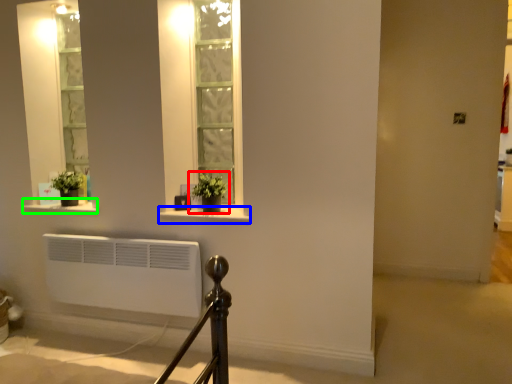
Question: Which object is the farthest from houseplant (highlighted by a red box)? Choose among these: window sill (highlighted by a blue box) or window sill (highlighted by a green box).

Choices:
 (A) window sill
 (B) window sill

Answer: (B)